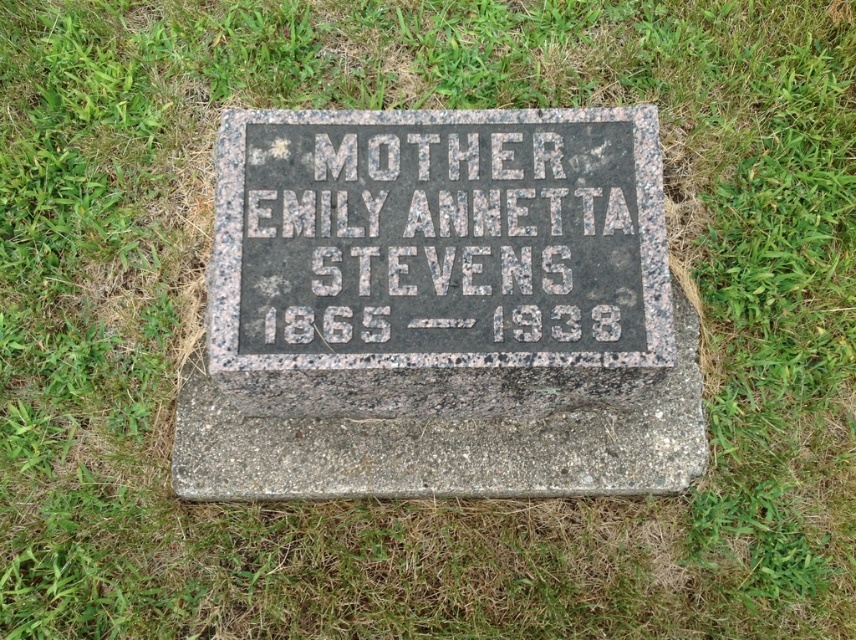
Between granite gravestone at center and granite at center, which one appears on the left side from the viewer's perspective?

From the viewer's perspective, granite at center appears more on the left side.

Identify the location of granite gravestone at center. The image size is (856, 640). (440, 308).

I want to click on granite gravestone at center, so click(x=440, y=308).